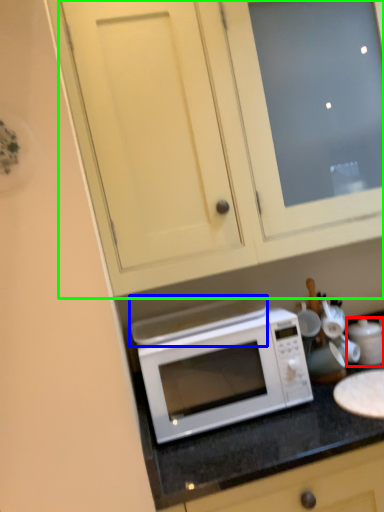
Question: Considering the real-world distances, which object is closest to appliance (highlighted by a red box)? exhaust hood (highlighted by a blue box) or cabinetry (highlighted by a green box).

Choices:
 (A) exhaust hood
 (B) cabinetry

Answer: (A)